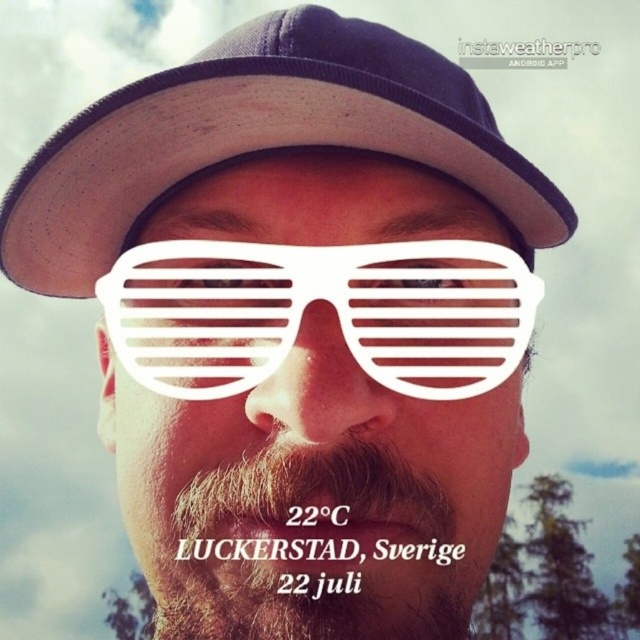
You are a photographer trying to capture a clear shot of both the dark blue fabric baseball hat at upper center and the brownwoollybeard at lower center. Given their sizes, which object should you focus on first to ensure it appears sharp in the photo?

The dark blue fabric baseball hat at upper center is larger in size than the brownwoollybeard at lower center, so you should focus on the dark blue fabric baseball hat at upper center first to ensure it appears sharp in the photo.

From the picture: Based on the scene description, what object is located at the coordinates point (330, 307)?

The point (330, 307) corresponds to the white plastic sunglasses at center.